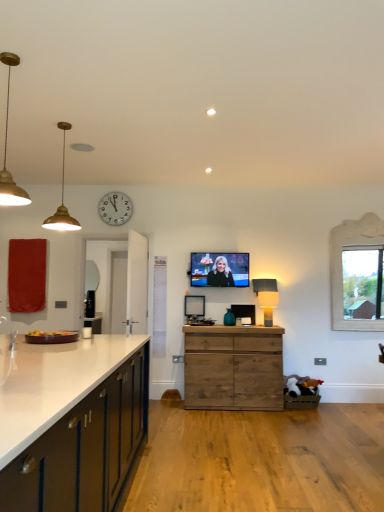
Question: Which direction should I rotate to look at matte black lamp at center, the first lamp in the back-to-front sequence, — up or down?

Choices:
 (A) down
 (B) up

Answer: (A)

Question: Is the depth of matte black tv at center, which is counted as the third picture frame, starting from the bottom, greater than that of gold metallic pendant light at left, which is the third lamp in back-to-front order?

Choices:
 (A) yes
 (B) no

Answer: (A)

Question: From the image's perspective, is matte black tv at center, positioned as the 1th picture frame in top-to-bottom order, on gold metallic pendant light at left, which appears as the first lamp when viewed from the top?

Choices:
 (A) yes
 (B) no

Answer: (B)

Question: Does matte black tv at center, which is counted as the third picture frame, starting from the bottom, appear on the left side of gold metallic pendant light at left, which appears as the first lamp when viewed from the top?

Choices:
 (A) yes
 (B) no

Answer: (B)

Question: From a real-world perspective, is matte black tv at center, positioned as the 1th picture frame in top-to-bottom order, located beneath gold metallic pendant light at left, which appears as the first lamp when viewed from the top?

Choices:
 (A) no
 (B) yes

Answer: (B)

Question: Is matte black tv at center, positioned as the 1th picture frame in top-to-bottom order, completely or partially outside of gold metallic pendant light at left, the third lamp from the right?

Choices:
 (A) no
 (B) yes

Answer: (B)

Question: Can you see matte black tv at center, positioned as the 1th picture frame in top-to-bottom order, touching gold metallic pendant light at left, which is counted as the 1th lamp, starting from the front?

Choices:
 (A) no
 (B) yes

Answer: (A)

Question: From a real-world perspective, is white wooden clock at upper center located beneath red fabric curtain at left?

Choices:
 (A) yes
 (B) no

Answer: (B)

Question: Does white wooden clock at upper center have a larger size compared to red fabric curtain at left?

Choices:
 (A) no
 (B) yes

Answer: (A)

Question: Is white wooden clock at upper center turned away from red fabric curtain at left?

Choices:
 (A) no
 (B) yes

Answer: (A)

Question: Is white wooden clock at upper center thinner than red fabric curtain at left?

Choices:
 (A) yes
 (B) no

Answer: (A)

Question: Considering the relative sizes of white wooden clock at upper center and red fabric curtain at left in the image provided, is white wooden clock at upper center smaller than red fabric curtain at left?

Choices:
 (A) no
 (B) yes

Answer: (B)

Question: From a real-world perspective, is white wooden clock at upper center on red fabric curtain at left?

Choices:
 (A) yes
 (B) no

Answer: (A)

Question: Is red fabric curtain at left further to camera compared to white wooden clock at upper center?

Choices:
 (A) no
 (B) yes

Answer: (A)